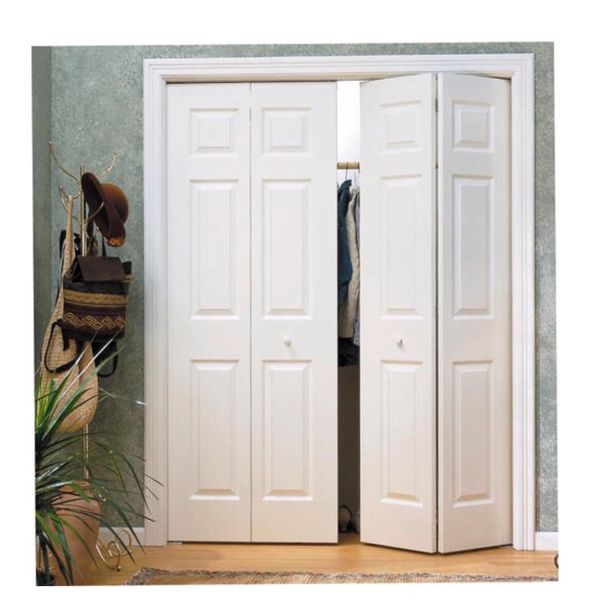
Identify the location of plant pot. The image size is (600, 600). (97, 545).